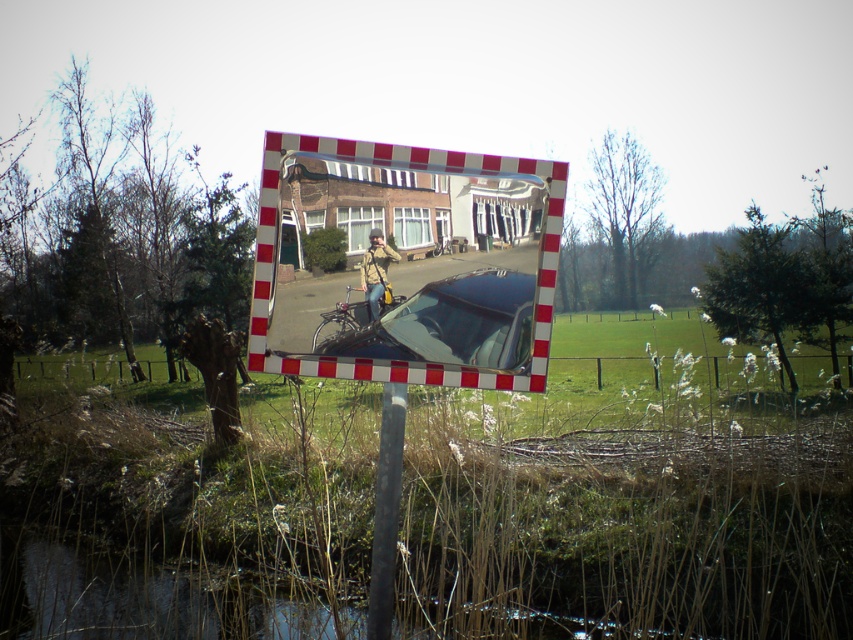
You are a photographer wanting to capture both the reflective glass mirror at center and the matte black car at center in a single frame. Given their widths, which object should you position closer to the camera to ensure both fit in the frame?

Since the reflective glass mirror at center is wider than the matte black car at center, you should position the matte black car at center closer to the camera to ensure both fit within the frame.

You are a photographer trying to capture a shot of both the reflective glass mirror at center and the matte black car at center in the same frame. Based on their positions, which object should you position yourself closer to in order to include both in your photo without moving either object?

Since the reflective glass mirror at center is to the left of the matte black car at center, you should position yourself closer to the reflective glass mirror at center to ensure both objects are included in the frame.